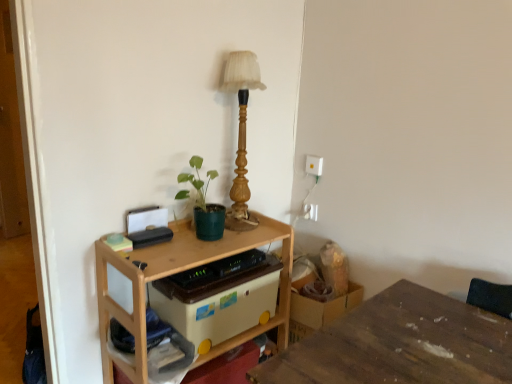
I want to click on vacant area situated below green matte plant at center (from a real-world perspective), so click(x=195, y=243).